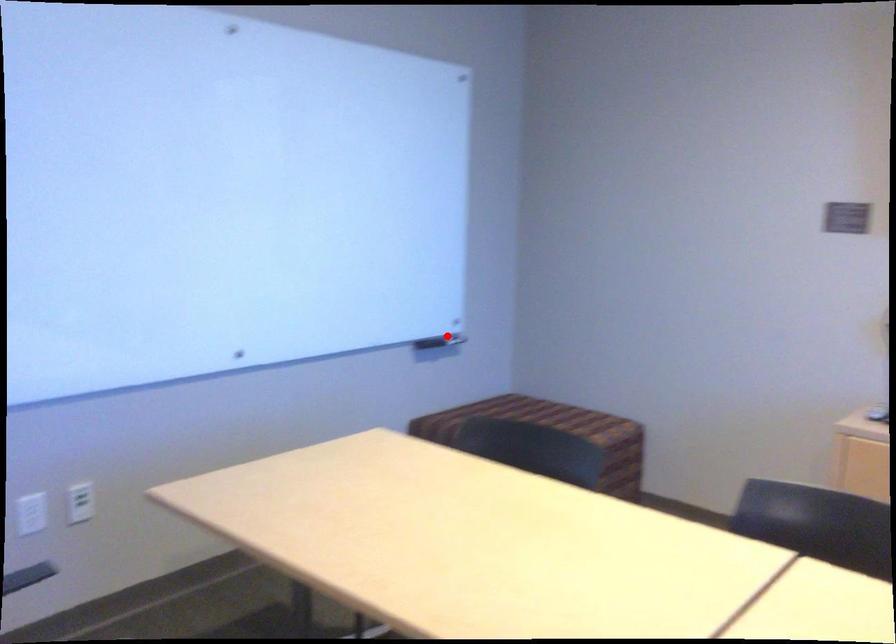
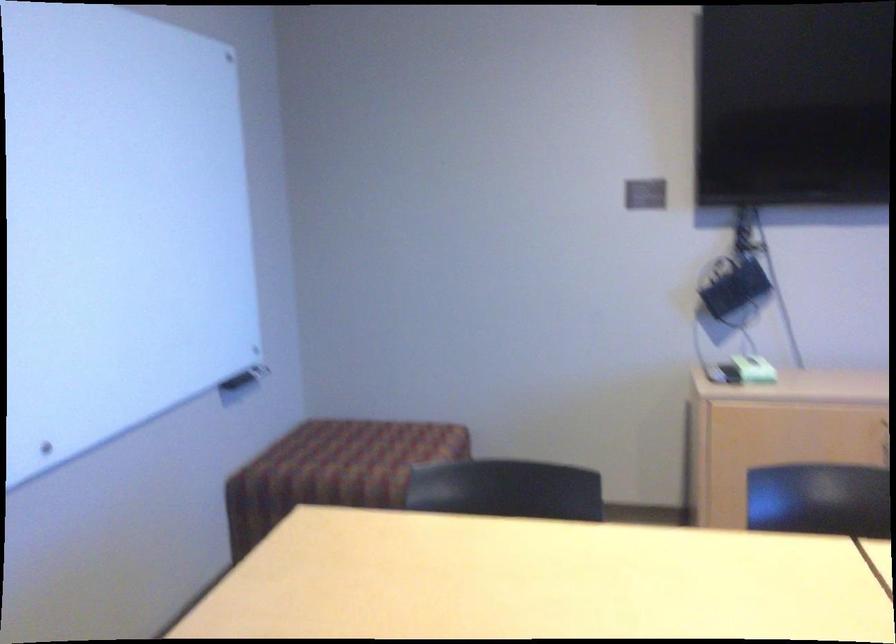
Question: I am providing you with two images of the same scene from different viewpoints. A red point is shown in image1. For the corresponding object point in image2, is it positioned nearer or farther from the camera?

Choices:
 (A) Nearer
 (B) Farther

Answer: (A)